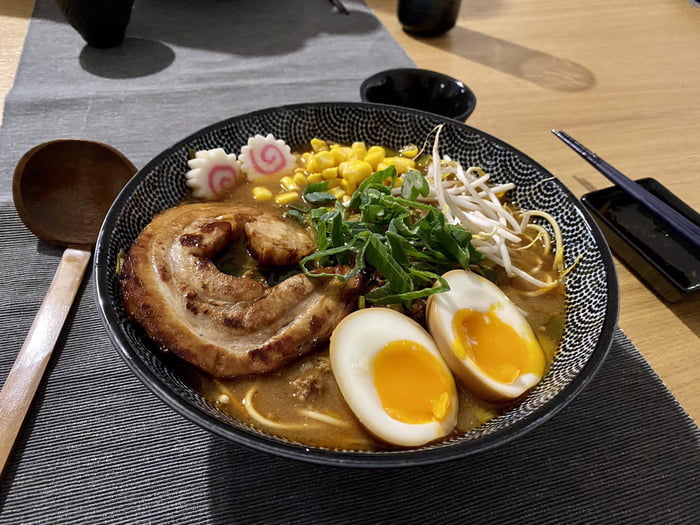
Where is `wood spoon`? wood spoon is located at coordinates (27, 227).